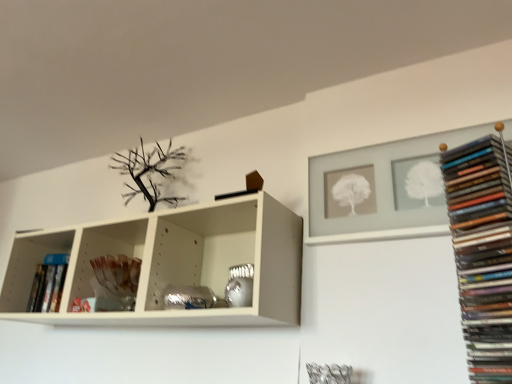
Question: Is translucent glass vase at center, positioned as the first shelf in left-to-right order, inside the boundaries of white matte frame at upper right, the 2th shelf positioned from the bottom, or outside?

Choices:
 (A) inside
 (B) outside

Answer: (B)

Question: From a real-world perspective, is translucent glass vase at center, placed as the 1th shelf when sorted from bottom to top, physically located above or below white matte frame at upper right, the 2th shelf positioned from the bottom?

Choices:
 (A) above
 (B) below

Answer: (B)

Question: Which is farther from the hardcover book at left, which ranks as the first book in back-to-front order?

Choices:
 (A) matte black books at right, positioned as the 1th book in front-to-back order
 (B) white matte frame at upper right, placed as the first shelf when sorted from top to bottom
 (C) translucent glass vase at center, which ranks as the 2th shelf in top-to-bottom order

Answer: (A)

Question: Which is farther from the translucent glass vase at center, the 2th shelf from the right?

Choices:
 (A) matte black books at right, positioned as the 1th book in front-to-back order
 (B) hardcover book at left, which appears as the second book when viewed from the right
 (C) white matte frame at upper right, which is the 2th shelf from left to right

Answer: (A)